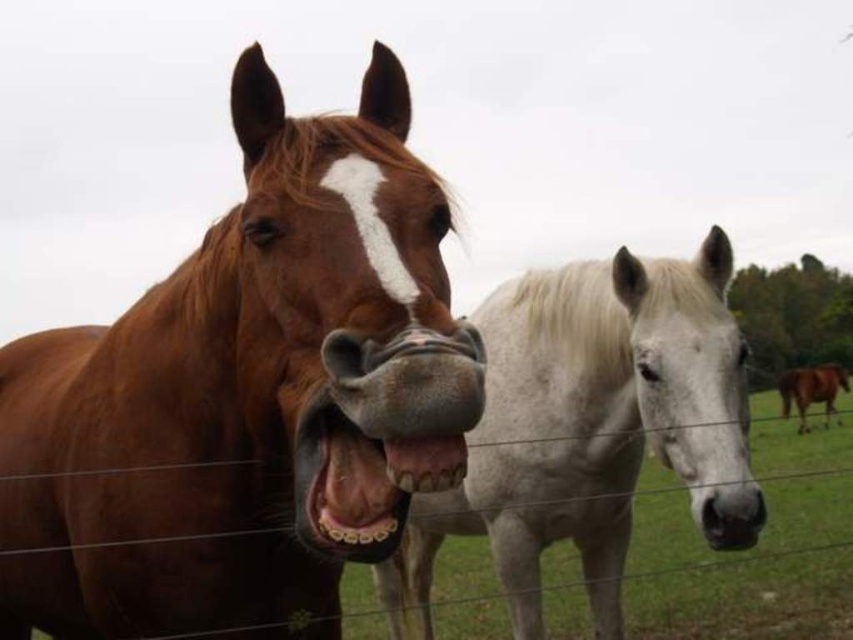
From the picture: You are a photographer trying to capture a closeup shot of the brown horse with the white blaze. You notice two features in the center of the image. Which one is closer to your camera lens between the teethporcelainmouth at center and the black rubber nose at center?

The teethporcelainmouth at center is closer to the camera lens because it is positioned in front of the black rubber nose at center.

Based on the photo, you are a photographer trying to capture a closeup of the teeth metallic at center and the brown glossy horse at right. Given that your camera can only focus on objects wider than 5 cm, can both objects be captured clearly in the same shot?

The teeth metallic at center is less than 5 cm in width, so it cannot be captured clearly. However, the brown glossy horse at right is wider than the teeth metallic at center, but since its width is not specified, we cannot confirm if it meets the 5 cm requirement. Please check the actual size of the brown glossy horse at right.

You are a photographer standing behind a wire fence trying to capture a close shot of the teeth metallic at center and brown glossy horse at right. The camera you are using has a maximum focus range of 10 meters. Will you be able to focus on both subjects clearly?

The teeth metallic at center is 10.63 meters away from brown glossy horse at right. Since the camera can only focus up to 10 meters, the distance between them is beyond the camera s maximum focus range. Therefore, you won t be able to focus on both subjects clearly at the same time.